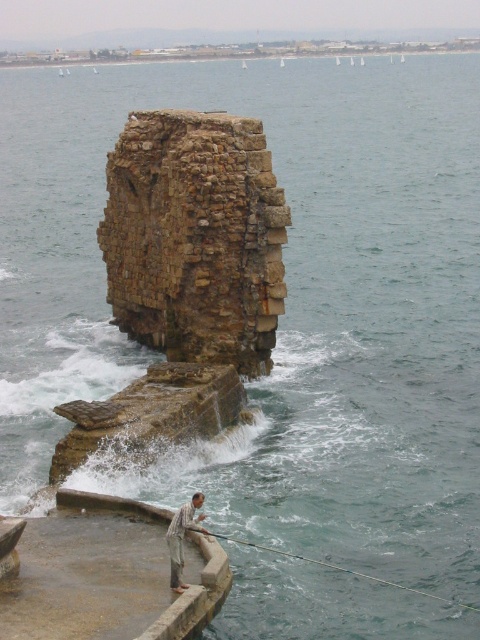
Question: Can you confirm if rusty stone pillar at center is wider than smooth concrete dock at lower left?

Choices:
 (A) no
 (B) yes

Answer: (B)

Question: Considering the real-world distances, which object is closest to the smooth concrete dock at lower left?

Choices:
 (A) light gray cotton shirt at lower center
 (B) rusty stone pillar at center

Answer: (A)

Question: Which point is farther to the camera?

Choices:
 (A) smooth concrete dock at lower left
 (B) rusty stone pillar at center
 (C) metallic wire fishing pole at lower center

Answer: (B)

Question: Which object appears closest to the camera in this image?

Choices:
 (A) rusty stone pillar at center
 (B) metallic wire fishing pole at lower center
 (C) smooth concrete dock at lower left

Answer: (C)

Question: Is smooth concrete dock at lower left below metallic wire fishing pole at lower center?

Choices:
 (A) no
 (B) yes

Answer: (A)

Question: Does smooth concrete dock at lower left appear on the left side of metallic wire fishing pole at lower center?

Choices:
 (A) yes
 (B) no

Answer: (A)